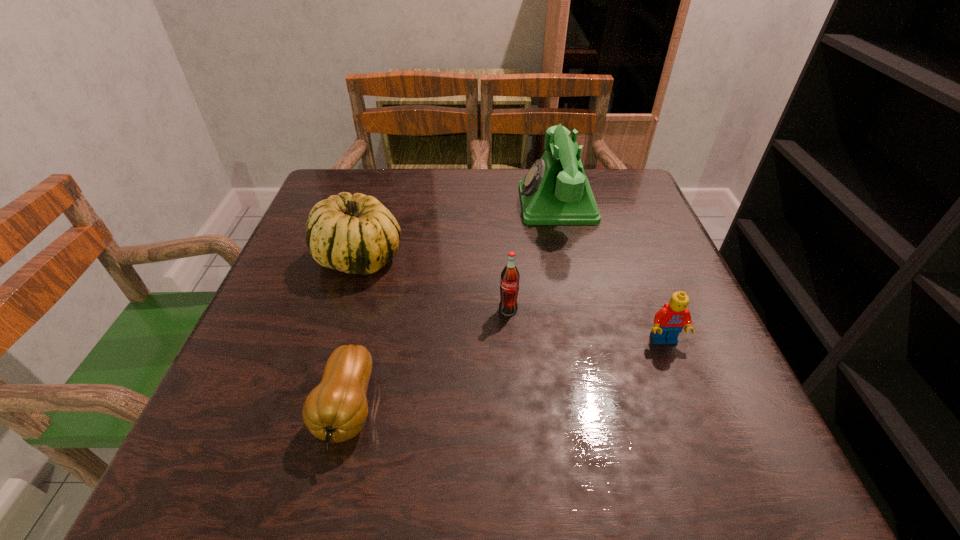
I want to click on the second object from right to left, so click(x=555, y=191).

The height and width of the screenshot is (540, 960). In order to click on telephone in this screenshot , I will do `click(555, 191)`.

Where is `the farther gourd`? the farther gourd is located at coordinates (356, 234).

Locate an element on the screen. The image size is (960, 540). the third farthest object is located at coordinates (509, 284).

This screenshot has height=540, width=960. Find the location of `the third object from left to right`. the third object from left to right is located at coordinates (509, 284).

In order to click on the rightmost object in this screenshot , I will do `click(669, 321)`.

This screenshot has width=960, height=540. Identify the location of Lego. (669, 321).

This screenshot has width=960, height=540. I want to click on the nearest object, so click(336, 410).

This screenshot has height=540, width=960. I want to click on the shorter gourd, so click(336, 410).

Where is `free space located on the dial of the tallest object`? free space located on the dial of the tallest object is located at coordinates (370, 204).